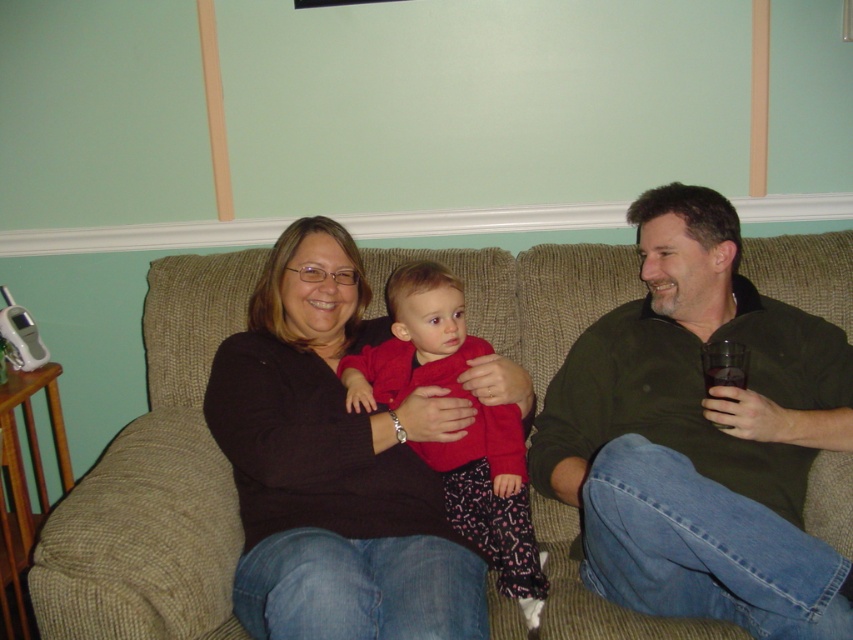
Question: Does green cotton shirt at right have a larger size compared to textured beige couch at center?

Choices:
 (A) yes
 (B) no

Answer: (A)

Question: Which of these objects is positioned farthest from the textured beige couch at center?

Choices:
 (A) green cotton shirt at right
 (B) matte red sweater at center

Answer: (A)

Question: Is black matte sweater at center to the right of matte red sweater at center from the viewer's perspective?

Choices:
 (A) no
 (B) yes

Answer: (A)

Question: Which object is positioned farthest from the black matte sweater at center?

Choices:
 (A) textured beige couch at center
 (B) green cotton shirt at right

Answer: (B)

Question: Is green cotton shirt at right to the right of textured beige couch at center from the viewer's perspective?

Choices:
 (A) yes
 (B) no

Answer: (A)

Question: Which object is positioned farthest from the green cotton shirt at right?

Choices:
 (A) textured beige couch at center
 (B) matte red sweater at center

Answer: (A)